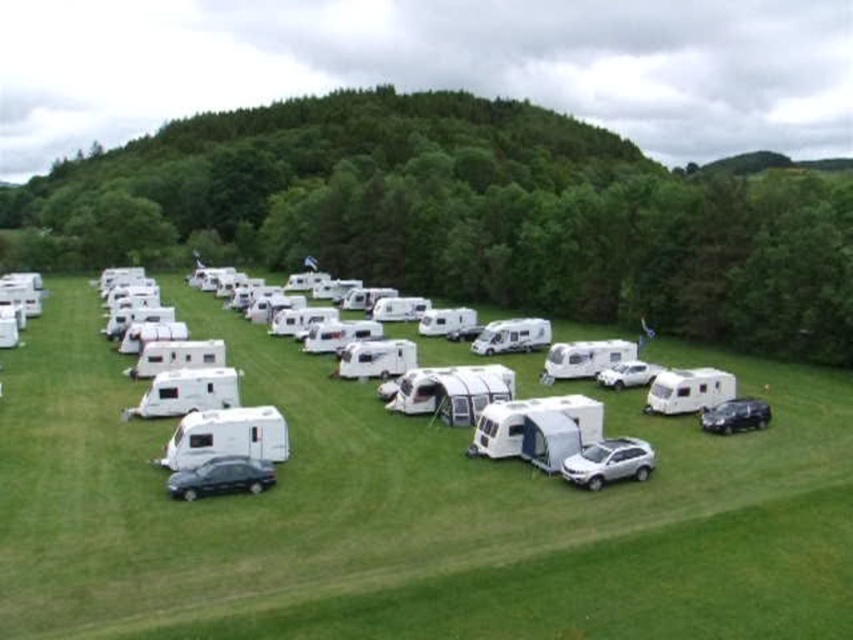
Question: Does satin silver suv at center appear on the left side of shiny dark gray car at lower left?

Choices:
 (A) yes
 (B) no

Answer: (B)

Question: Estimate the real-world distances between objects in this image. Which object is closer to the shiny dark gray car at lower left?

Choices:
 (A) satin black car at lower right
 (B) white matte car at center
 (C) green grassy field at center

Answer: (C)

Question: Based on their relative distances, which object is nearer to the white matte car at center?

Choices:
 (A) satin black car at lower right
 (B) green grassy field at center

Answer: (A)

Question: Is green grassy field at center positioned behind satin black car at lower right?

Choices:
 (A) yes
 (B) no

Answer: (B)

Question: Can you confirm if green grassy field at center is smaller than satin silver suv at center?

Choices:
 (A) yes
 (B) no

Answer: (B)

Question: Which of the following is the farthest from the observer?

Choices:
 (A) white matte car at center
 (B) satin silver suv at center
 (C) satin black car at lower right
 (D) shiny dark gray car at lower left

Answer: (A)